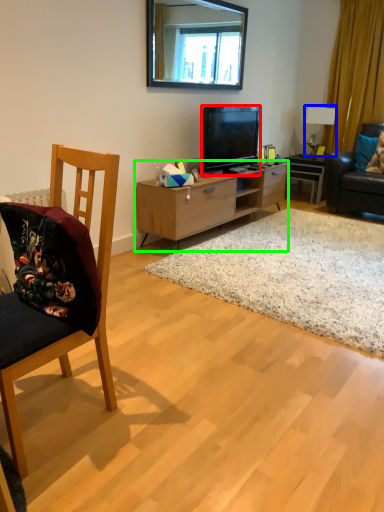
Question: Estimate the real-world distances between objects in this image. Which object is closer to television (highlighted by a red box), lamp (highlighted by a blue box) or cabinetry (highlighted by a green box)?

Choices:
 (A) lamp
 (B) cabinetry

Answer: (B)